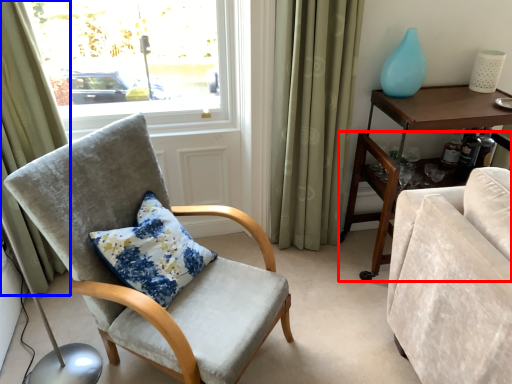
Question: Which object appears farthest to the camera in this image, desk (highlighted by a red box) or curtain (highlighted by a blue box)?

Choices:
 (A) desk
 (B) curtain

Answer: (A)